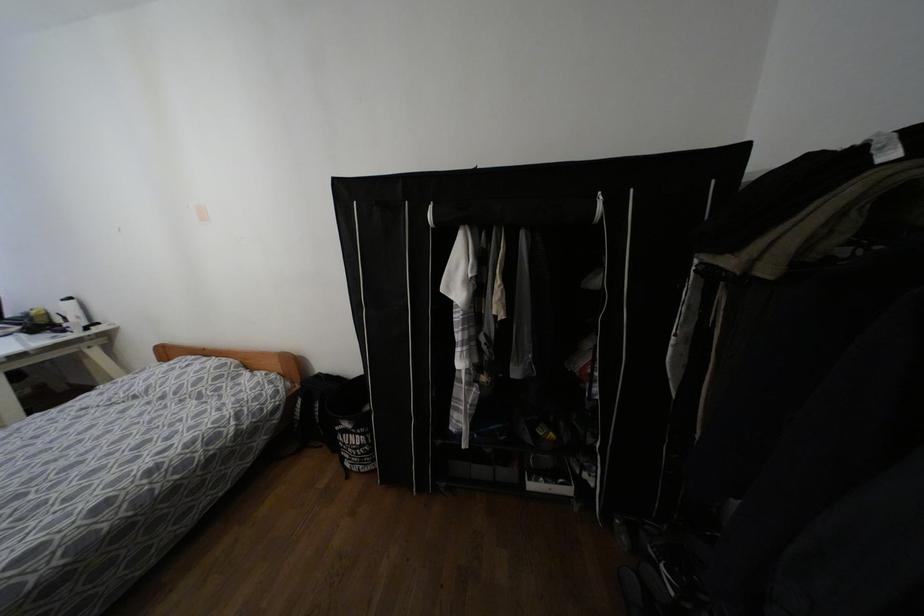
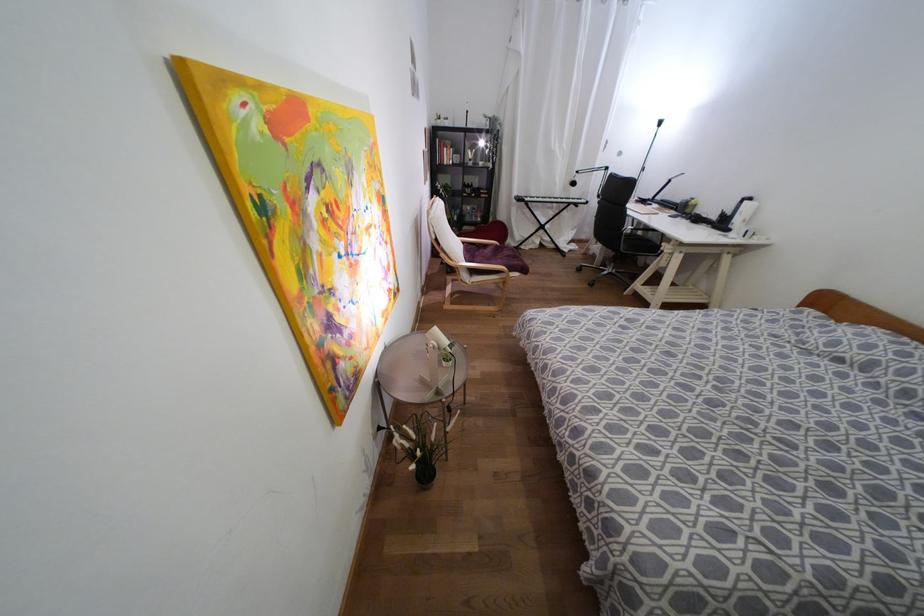
Where in the second image is the point corresponding to (68,299) from the first image?

(749, 198)